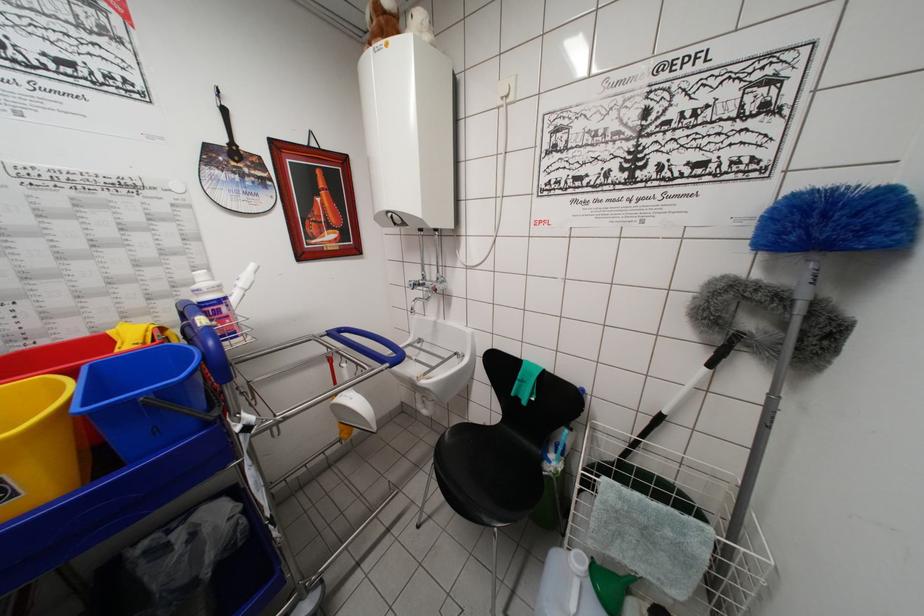
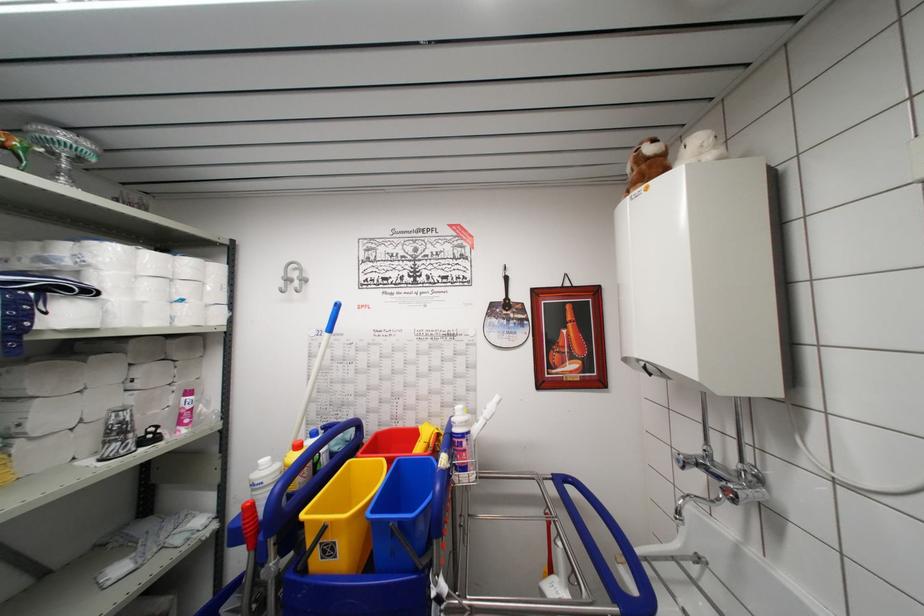
Where in the second image is the point corresponding to the point at 416,314 from the first image?

(681, 517)